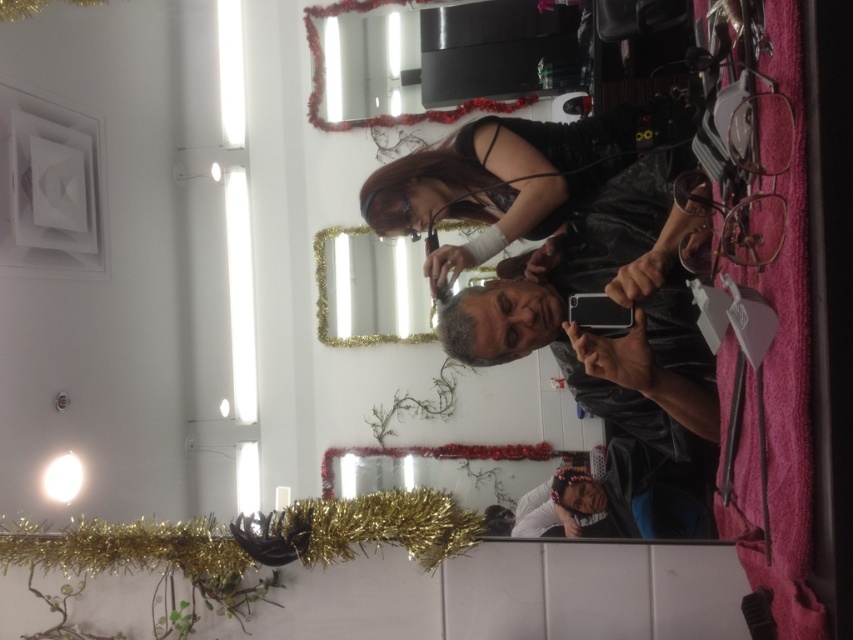
You are a customer in the hair salon and want to take a photo of both the shiny black phone at center and the gold glitter frame at center. Which object should you focus on first if you want to capture both in one shot without moving the camera?

Since the shiny black phone at center is larger than the gold glitter frame at center, you should focus on the shiny black phone at center first to ensure it fits properly in the frame.

You are a customer in a hair salon and you want to know if the distance between the black leather jacket at center and the gold glitter frame at center is more than 9 feet. Can you confirm?

The black leather jacket at center is 9.60 feet away from the gold glitter frame at center, so the distance is more than 9 feet.